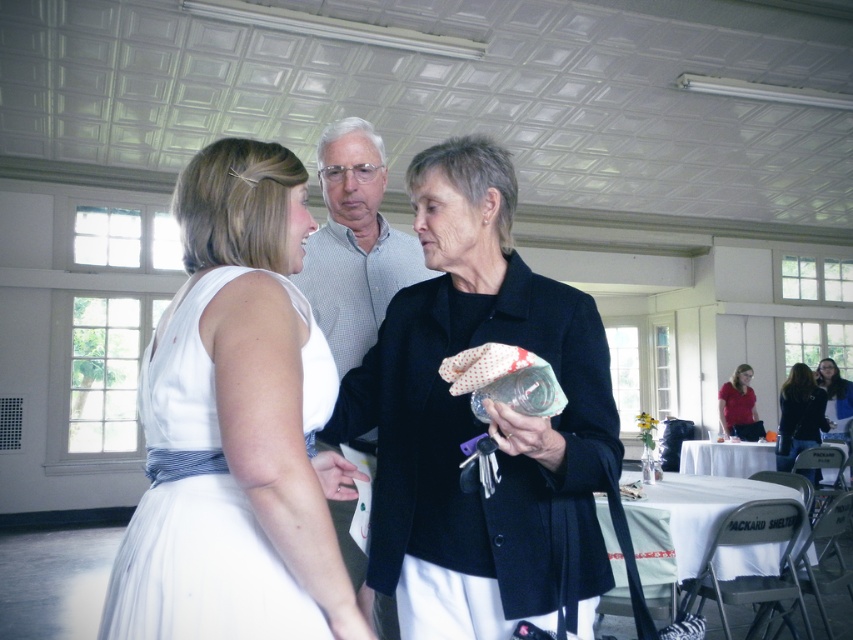
Which is behind, point (804, 376) or point (729, 401)?

The point (729, 401) is behind.

Does point (796, 440) lie in front of point (741, 364)?

That is True.

You are a GUI agent. You are given a task and a screenshot of the screen. Output one action in this format:
    pyautogui.click(x=<x>, y=<y>)
    Task: Click on the black fabric purse at center
    The width and height of the screenshot is (853, 640).
    Given the screenshot: What is the action you would take?
    pyautogui.click(x=799, y=416)

Which is behind, point (592, 452) or point (212, 515)?

Positioned behind is point (592, 452).

The height and width of the screenshot is (640, 853). Describe the element at coordinates (476, 420) in the screenshot. I see `matte black jacket at center` at that location.

Is point (357, 598) closer to camera compared to point (154, 525)?

That is False.

Where is `matte black jacket at center`? This screenshot has height=640, width=853. matte black jacket at center is located at coordinates (476, 420).

Does matte black jacket at center appear over white checkered shirt at center?

No.

Between matte black jacket at center and white checkered shirt at center, which one appears on the right side from the viewer's perspective?

matte black jacket at center is more to the right.

At what (x,y) coordinates should I click in order to perform the action: click on matte black jacket at center. Please return your answer as a coordinate pair (x, y). Looking at the image, I should click on (476, 420).

Where is `matte black jacket at center`? This screenshot has height=640, width=853. matte black jacket at center is located at coordinates (476, 420).